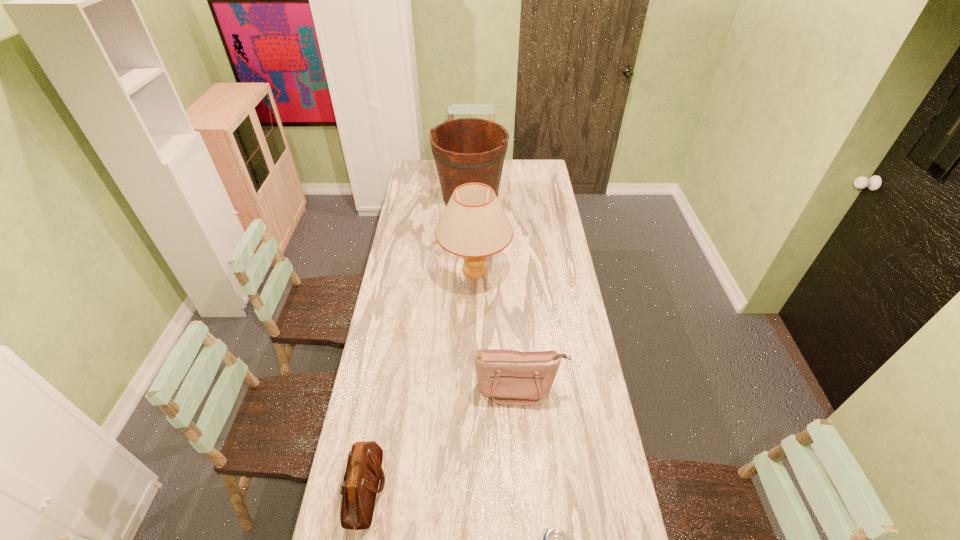
Identify the location of object present at the left edge. The image size is (960, 540). (364, 471).

Where is `object that is at the right edge`? object that is at the right edge is located at coordinates (509, 377).

I want to click on vacant region at the left edge of the desktop, so click(404, 211).

Find the location of `free space at the right edge of the desktop`. free space at the right edge of the desktop is located at coordinates (600, 446).

Locate an element on the screen. The height and width of the screenshot is (540, 960). vacant space that's between the leftmost object and the third nearest object is located at coordinates (443, 438).

This screenshot has height=540, width=960. Find the location of `free point between the lampshade and the right shoulder bag`. free point between the lampshade and the right shoulder bag is located at coordinates (497, 330).

At what (x,y) coordinates should I click in order to perform the action: click on vacant space in between the nearer shoulder bag and the bucket. Please return your answer as a coordinate pair (x, y). This screenshot has width=960, height=540. Looking at the image, I should click on (418, 344).

Locate which object ranks third in proximity to the fourth farthest object. Please provide its 2D coordinates. Your answer should be formatted as a tuple, i.e. [(x, y)], where the tuple contains the x and y coordinates of a point satisfying the conditions above.

[(474, 225)]

Locate which object ranks fourth in proximity to the lampshade. Please provide its 2D coordinates. Your answer should be formatted as a tuple, i.e. [(x, y)], where the tuple contains the x and y coordinates of a point satisfying the conditions above.

[(554, 539)]